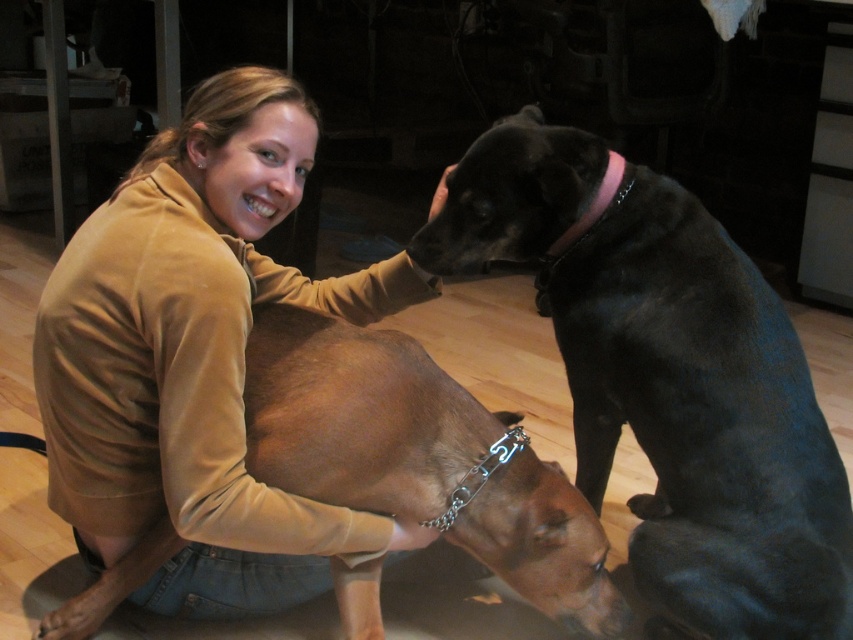
You are a photographer setting up a shoot in this scene. You need to place a small prop between the matte brown jacket at center and the pink fabric neckband at upper right. Based on their positions, where should you place the prop so it is directly in line with both objects?

The prop should be placed between the matte brown jacket at center and the pink fabric neckband at upper right, aligned vertically since the matte brown jacket at center is located below the pink fabric neckband at upper right.

In the scene shown: You are a photographer trying to capture a closeup of the brown leather dog at center and the pink fabric neckband at upper right. Which object is positioned closer to the front of the scene?

The brown leather dog at center is closer to the viewer than the pink fabric neckband at upper right, so it is positioned closer to the front of the scene.